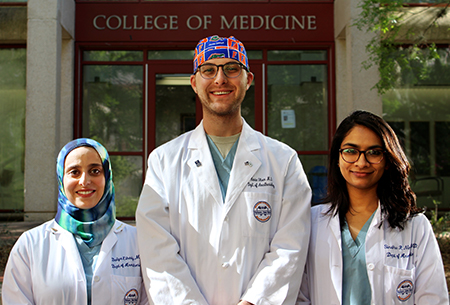
Identify the location of window. This screenshot has width=450, height=305. (307, 54), (300, 84), (308, 163), (127, 165), (120, 129), (122, 50), (168, 55), (170, 116), (248, 109).